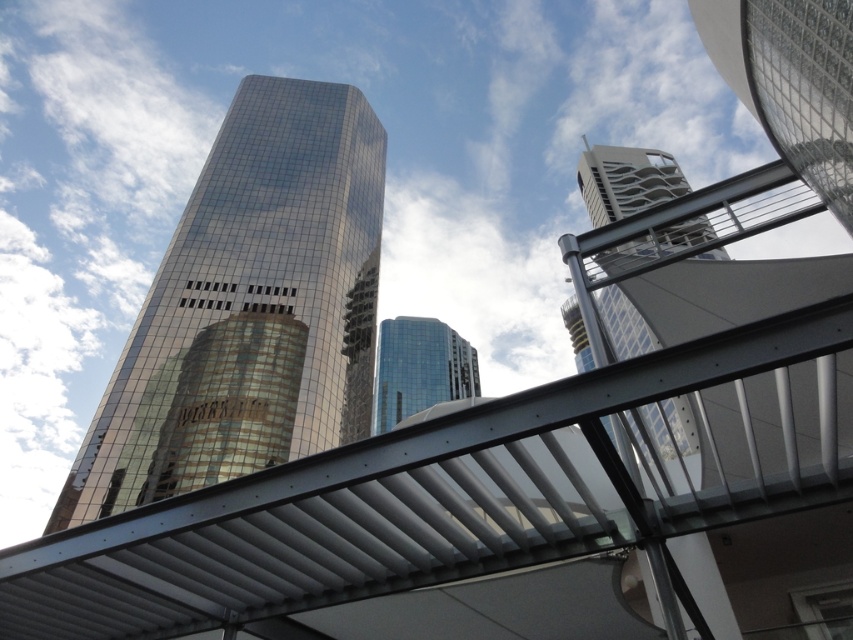
Is point (170, 410) closer to camera compared to point (592, 221)?

Yes, it is.

Where is `shiny glass skyscraper at center`? This screenshot has height=640, width=853. shiny glass skyscraper at center is located at coordinates (248, 308).

Where is `shiny glass skyscraper at center`? shiny glass skyscraper at center is located at coordinates (248, 308).

Can you confirm if shiny glass skyscraper at center is taller than glossy glass building at center?

Yes, shiny glass skyscraper at center is taller than glossy glass building at center.

Is shiny glass skyscraper at center bigger than glossy glass building at center?

Yes, shiny glass skyscraper at center is bigger than glossy glass building at center.

Between point (109, 480) and point (473, 381), which one is positioned behind?

The point (473, 381) is more distant.

Where is `shiny glass skyscraper at center`? The image size is (853, 640). shiny glass skyscraper at center is located at coordinates (248, 308).

From the picture: Does reflective glass skyscraper at upper right lie in front of glossy glass building at center?

Yes, reflective glass skyscraper at upper right is in front of glossy glass building at center.

Is point (646, 193) closer to camera compared to point (381, 356)?

Yes, it is.

The height and width of the screenshot is (640, 853). What do you see at coordinates (625, 180) in the screenshot?
I see `reflective glass skyscraper at upper right` at bounding box center [625, 180].

This screenshot has width=853, height=640. I want to click on reflective glass skyscraper at upper right, so click(625, 180).